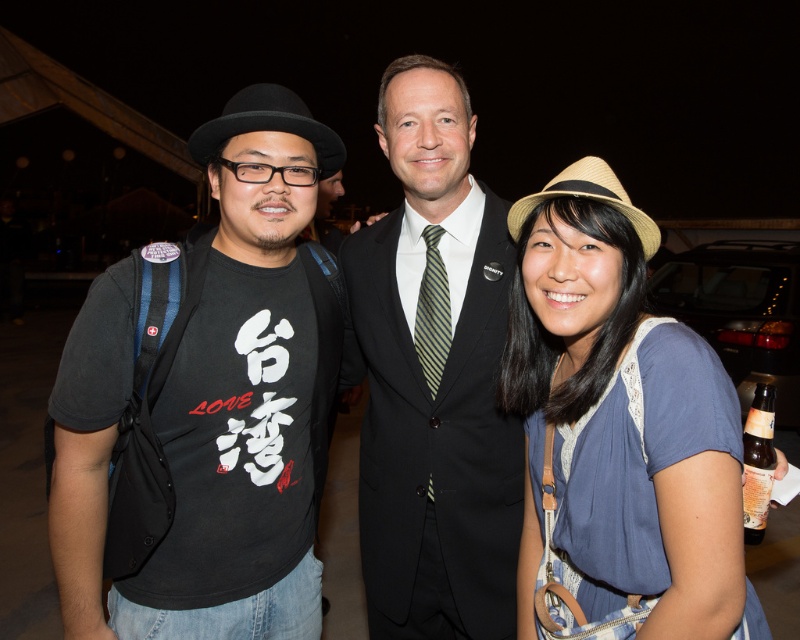
You are organizing a photo shoot and need to place a large poster behind the black suit at center and the brown glass bottle at lower right. Which object requires a larger poster to cover its width?

The black suit at center requires a larger poster since its width is greater than the brown glass bottle at lower right.

You are a photographer at the event and want to focus your camera on the blue cotton shirt at center. According to the coordinates provided, where should you aim your camera?

You should aim your camera at point 0.659 on the x axis and 0.776 on the y axis to focus on the blue cotton shirt at center.

You are standing at the point labeled as point (532, 536) and want to take a photo of the scene. The camera you are using has a focal length of 50mm and a sensor size of 24mm x 36mm. What is the field of view of the camera at this distance?

The field of view can be calculated using the formula FOV_horizontal_degrees. However, since the distance to the camera is 1.56 meters, the field of view would be approximately 27 degrees horizontally and 18 degrees vertically.